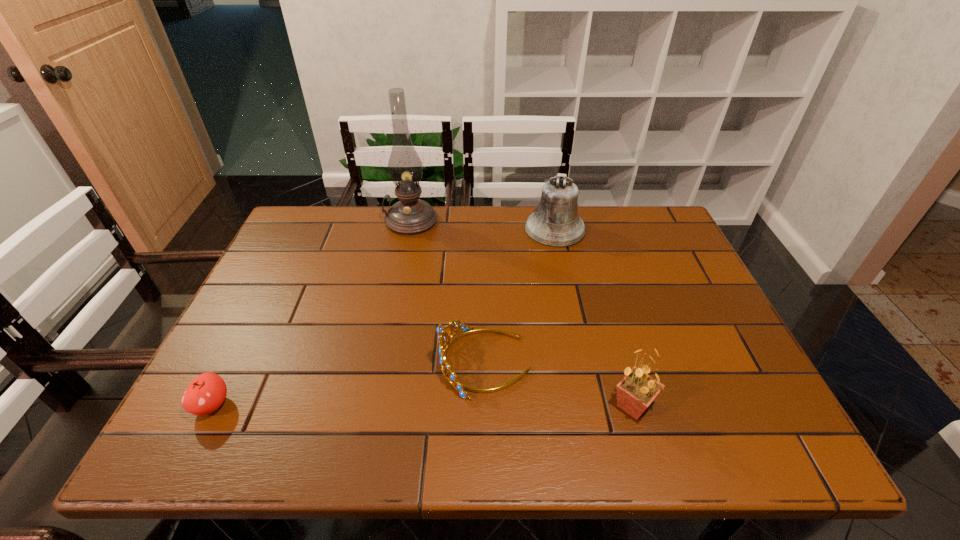
This screenshot has height=540, width=960. What are the coordinates of `blank space located at the front of the sunflower with flowers visible` in the screenshot? It's located at (516, 406).

Identify the location of vacant space located at the front of the sunflower with flowers visible. This screenshot has width=960, height=540. (472, 406).

At what (x,y) coordinates should I click in order to perform the action: click on blank space located at the front of the sunflower with flowers visible. Please return your answer as a coordinate pair (x, y). This screenshot has width=960, height=540. Looking at the image, I should click on (507, 406).

Locate an element on the screen. The image size is (960, 540). free location located on the front-facing side of the third object from left to right is located at coordinates (345, 363).

I want to click on vacant position located 0.130m on the front-facing side of the third object from left to right, so click(381, 363).

Where is `free space located 0.140m on the front-facing side of the third object from left to right`? free space located 0.140m on the front-facing side of the third object from left to right is located at coordinates (376, 363).

Identify the location of blank area located on the right of the leftmost object. This screenshot has width=960, height=540. (352, 405).

Locate an element on the screen. oil lamp that is at the far edge is located at coordinates (410, 215).

Identify the location of bell at the far edge. (555, 223).

Image resolution: width=960 pixels, height=540 pixels. In order to click on sunflower at the near edge in this screenshot , I will do `click(635, 392)`.